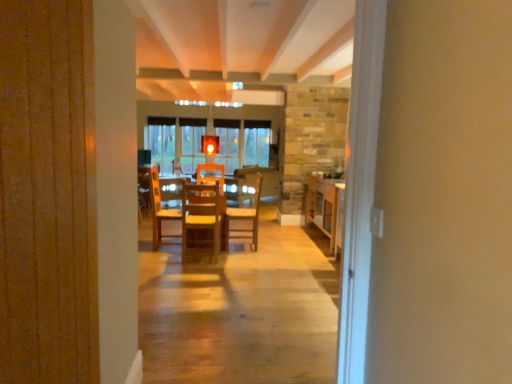
Where is `free point in front of wooden chair at center, positioned as the 1th chair in left-to-right order`? free point in front of wooden chair at center, positioned as the 1th chair in left-to-right order is located at coordinates (194, 263).